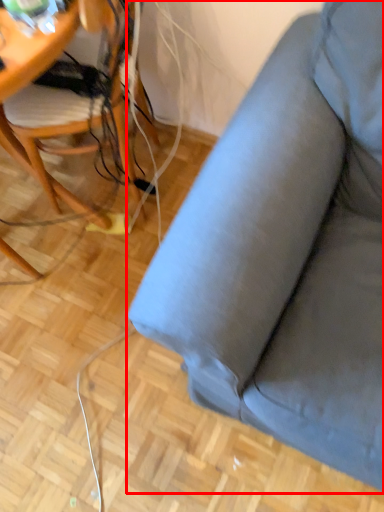
Question: From the image's perspective, where is studio couch (annotated by the red box) located in relation to chair in the image?

Choices:
 (A) below
 (B) above

Answer: (A)